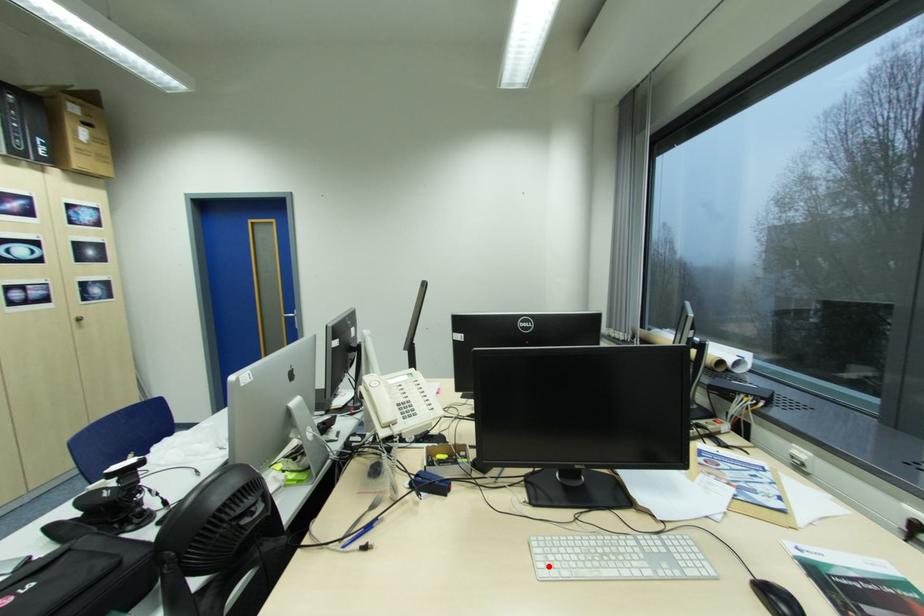
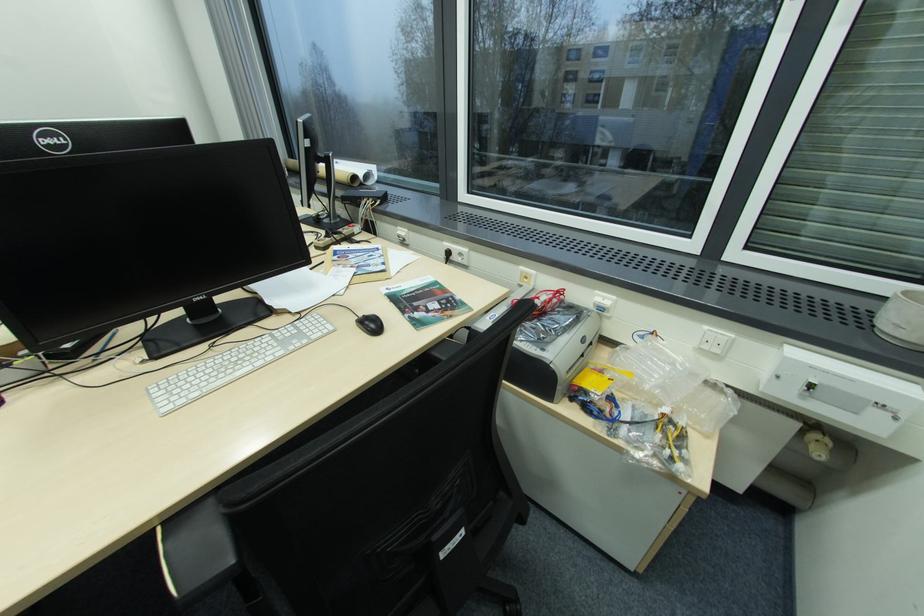
Where in the second image is the point corresponding to the highlighted location from the first image?

(172, 403)